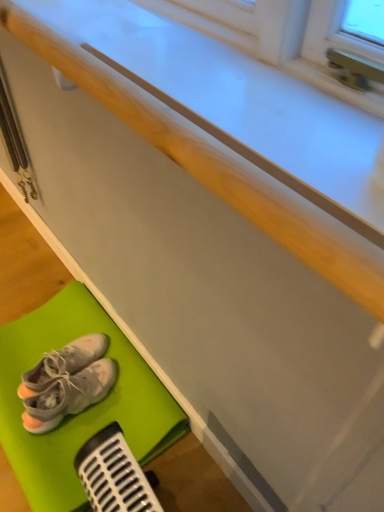
The width and height of the screenshot is (384, 512). In order to click on free spot to the right of white fabric sneakers at lower left, which appears as the 1th footwear when viewed from the top in this screenshot , I will do `click(129, 386)`.